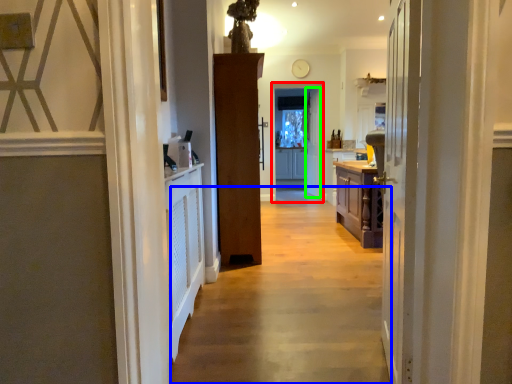
Question: Which object is positioned closest to screen door (highlighted by a red box)? Select from path (highlighted by a blue box) and door (highlighted by a green box).

Choices:
 (A) path
 (B) door

Answer: (B)